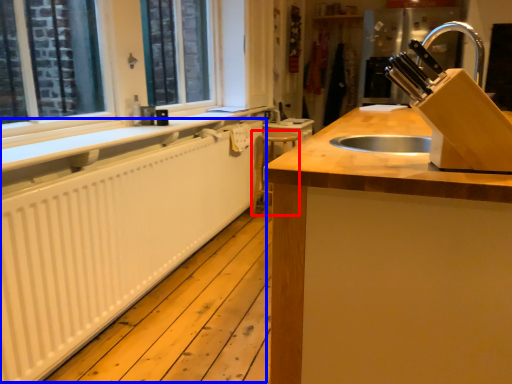
Question: Which of the following is the closest to the observer, step stool (highlighted by a red box) or radiator (highlighted by a blue box)?

Choices:
 (A) step stool
 (B) radiator

Answer: (B)